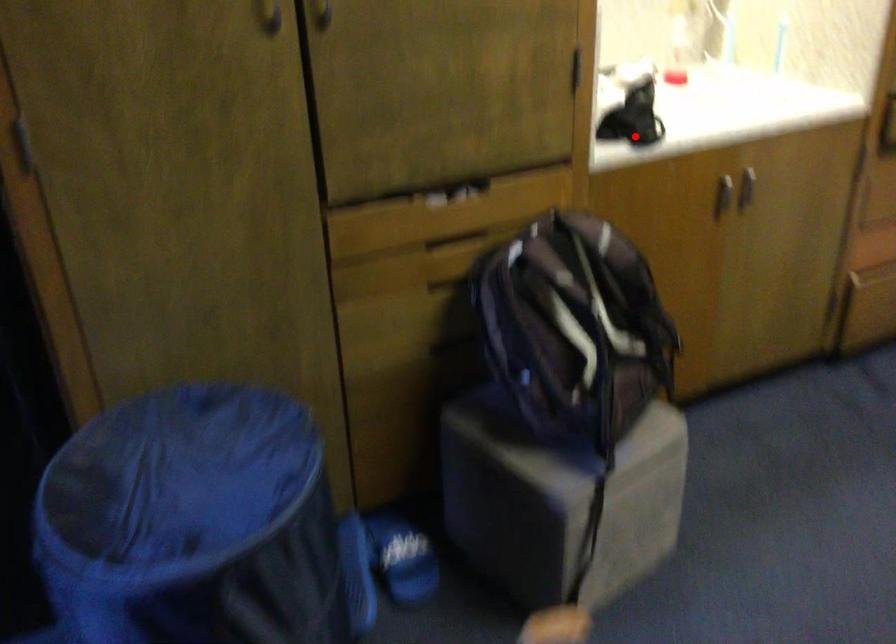
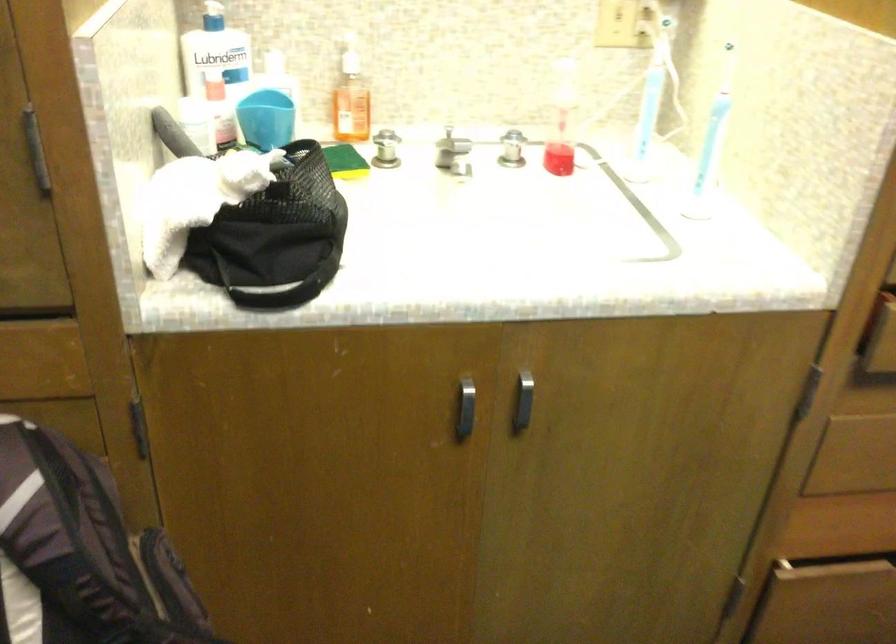
The point at the highlighted location is marked in the first image. Where is the corresponding point in the second image?

(279, 286)